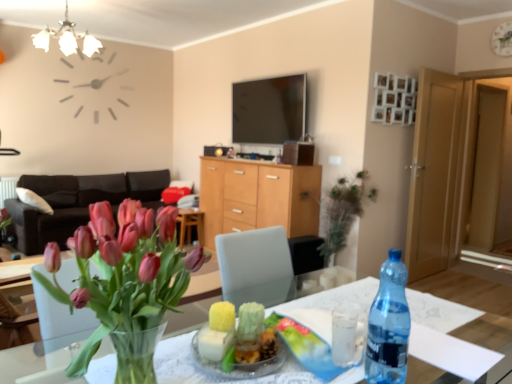
Find the location of a particular element. The height and width of the screenshot is (384, 512). free spot above transparent glass door at right, positioned as the second glass door in left-to-right order (from a real-world perspective) is located at coordinates (492, 63).